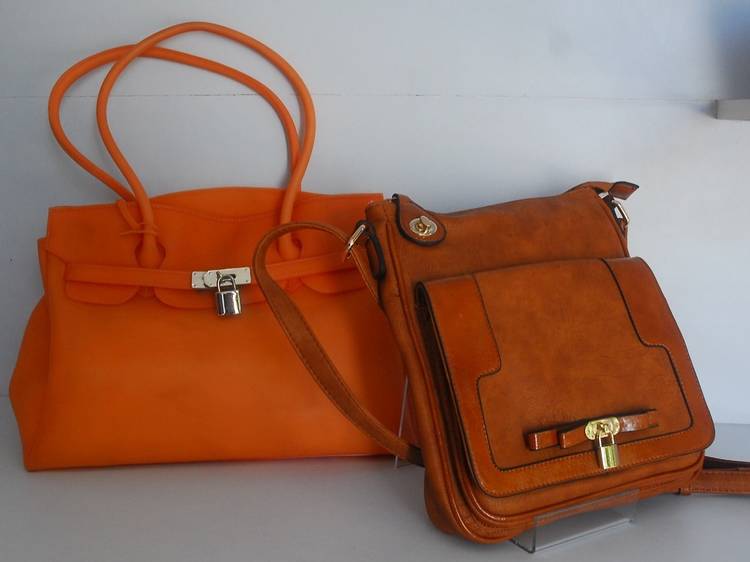
Locate an element on the screen. horizontal line on wall is located at coordinates (196, 94).